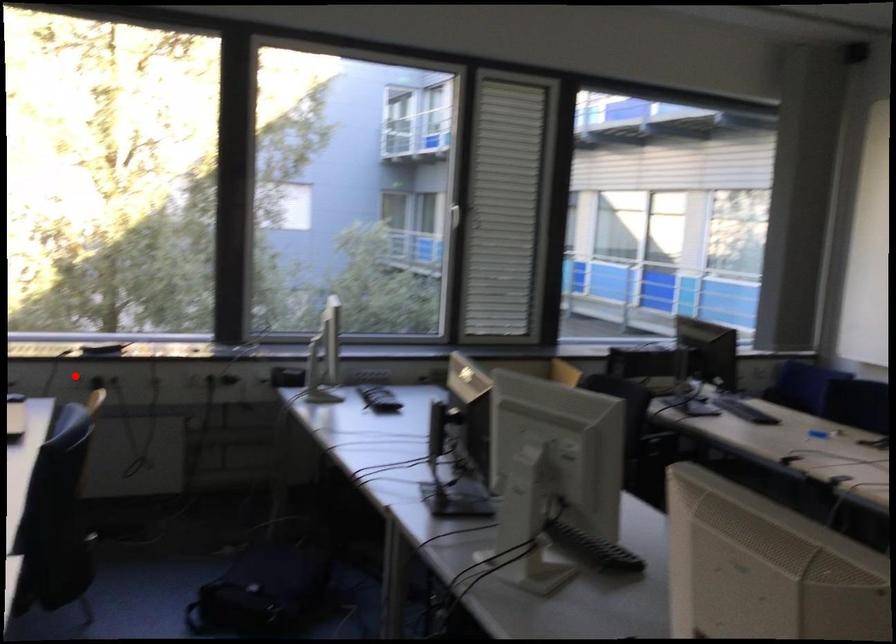
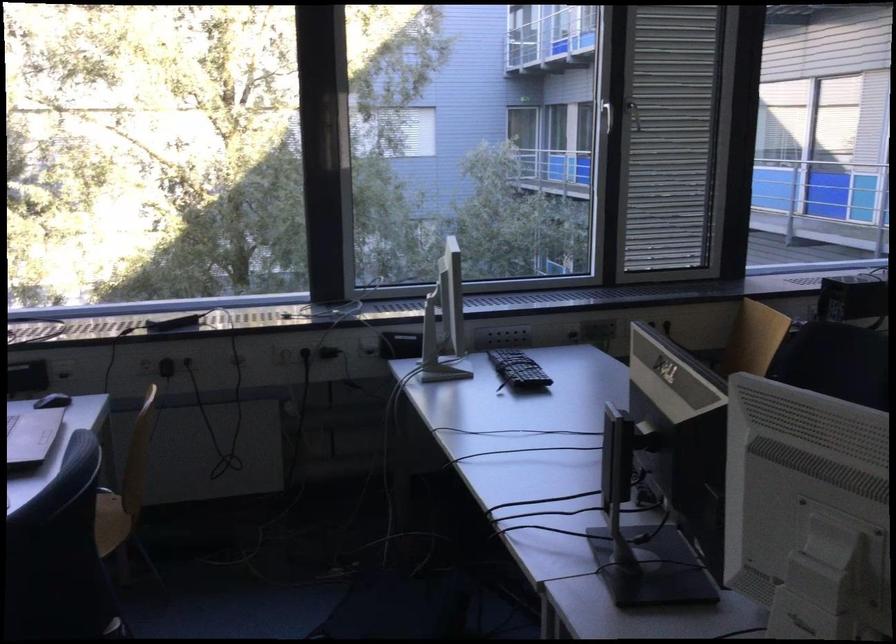
In the second image, find the point that corresponds to the highlighted location in the first image.

(144, 365)